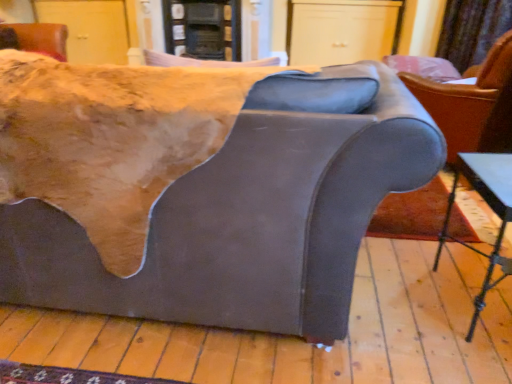
Question: Considering the relative sizes of velvet curtain at upper right and suede-like gray couch at center in the image provided, is velvet curtain at upper right thinner than suede-like gray couch at center?

Choices:
 (A) yes
 (B) no

Answer: (A)

Question: Can you confirm if velvet curtain at upper right is shorter than suede-like gray couch at center?

Choices:
 (A) yes
 (B) no

Answer: (A)

Question: Is velvet curtain at upper right taller than suede-like gray couch at center?

Choices:
 (A) no
 (B) yes

Answer: (A)

Question: Is velvet curtain at upper right beside suede-like gray couch at center?

Choices:
 (A) no
 (B) yes

Answer: (A)

Question: Is velvet curtain at upper right smaller than suede-like gray couch at center?

Choices:
 (A) no
 (B) yes

Answer: (B)

Question: Could suede-like gray couch at center be considered to be inside velvet curtain at upper right?

Choices:
 (A) yes
 (B) no

Answer: (B)

Question: Is matte gray armchair at right bigger than metallic silver table at lower right?

Choices:
 (A) yes
 (B) no

Answer: (A)

Question: Is matte gray armchair at right thinner than metallic silver table at lower right?

Choices:
 (A) yes
 (B) no

Answer: (B)

Question: Is matte gray armchair at right at the right side of metallic silver table at lower right?

Choices:
 (A) yes
 (B) no

Answer: (A)

Question: Is metallic silver table at lower right at the back of matte gray armchair at right?

Choices:
 (A) no
 (B) yes

Answer: (A)

Question: Is matte gray armchair at right aimed at metallic silver table at lower right?

Choices:
 (A) no
 (B) yes

Answer: (A)

Question: Is matte gray armchair at right next to metallic silver table at lower right and touching it?

Choices:
 (A) yes
 (B) no

Answer: (B)

Question: Does velvet curtain at upper right come behind metallic silver table at lower right?

Choices:
 (A) yes
 (B) no

Answer: (A)